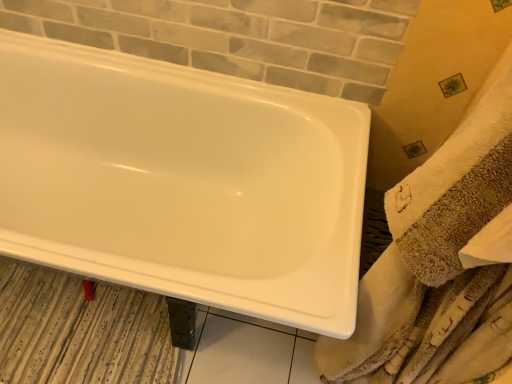
Question: Looking at the image, does striped fabric bath mat at lower left seem bigger or smaller compared to white glossy bathtub at upper left?

Choices:
 (A) big
 (B) small

Answer: (B)

Question: Which is correct: striped fabric bath mat at lower left is inside white glossy bathtub at upper left, or outside of it?

Choices:
 (A) outside
 (B) inside

Answer: (B)

Question: Which of these objects is positioned closest to the striped fabric bath mat at lower left?

Choices:
 (A) beige textured towel at right
 (B) white glossy bathtub at upper left

Answer: (B)

Question: Based on their relative distances, which object is farther from the white glossy bathtub at upper left?

Choices:
 (A) striped fabric bath mat at lower left
 (B) beige textured towel at right

Answer: (B)